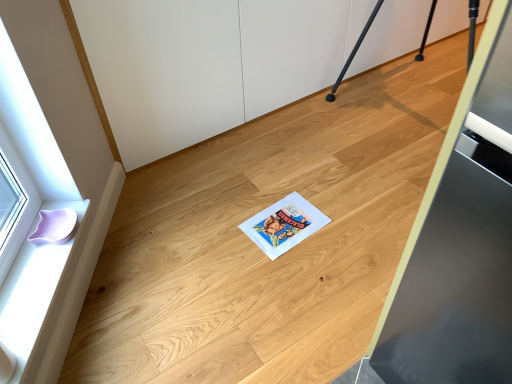
Locate an element on the screen. The image size is (512, 384). free space to the right of white paper comic book at center is located at coordinates (345, 227).